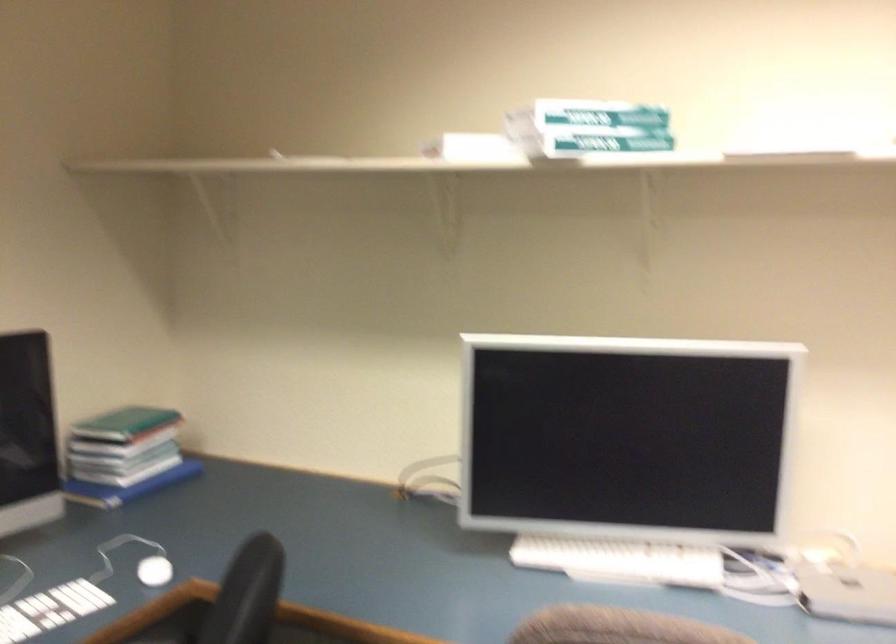
Question: The camera is either moving clockwise (left) or counter-clockwise (right) around the object. The first image is from the beginning of the video and the second image is from the end. Is the camera moving left or right when shooting the video?

Choices:
 (A) Left
 (B) Right

Answer: (A)